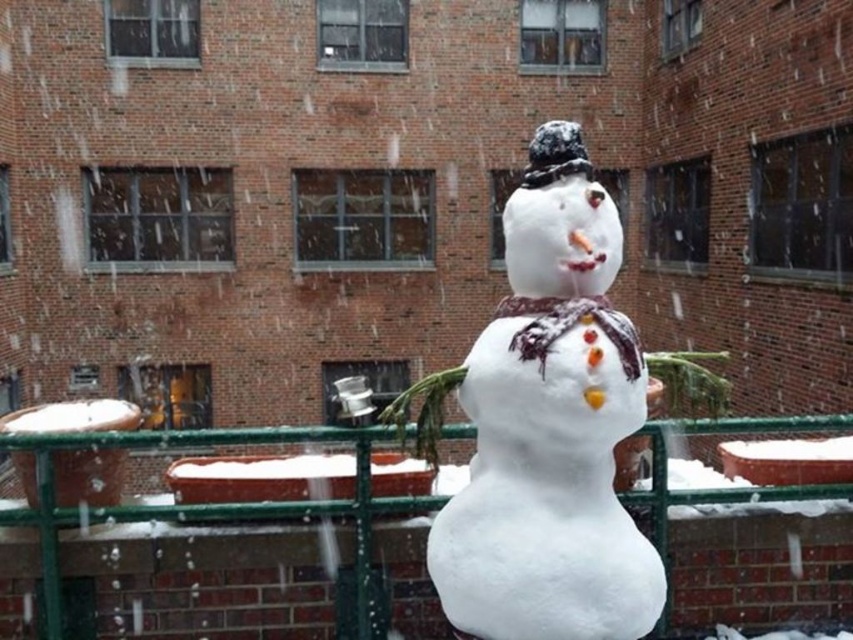
Between point (544, 234) and point (28, 513), which one is positioned in front?

Point (544, 234)

Is point (610, 368) closer to viewer compared to point (57, 564)?

Yes, point (610, 368) is closer to viewer.

The width and height of the screenshot is (853, 640). I want to click on white fluffy snowman at center, so click(550, 428).